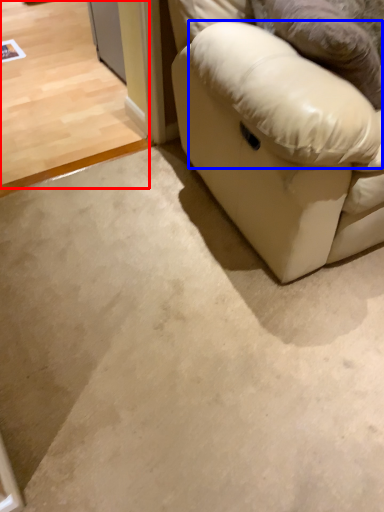
Question: Among these objects, which one is nearest to the camera, concrete (highlighted by a red box) or pillow (highlighted by a blue box)?

Choices:
 (A) concrete
 (B) pillow

Answer: (B)